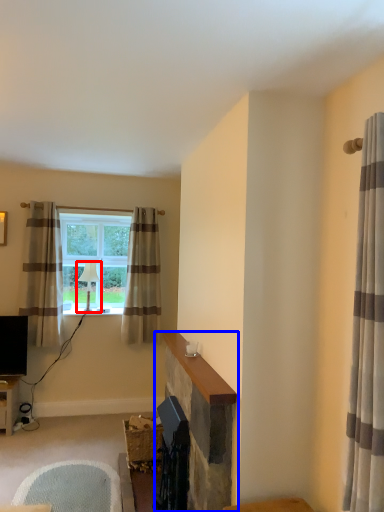
Question: Which object appears closest to the camera in this image, lamp (highlighted by a red box) or fireplace (highlighted by a blue box)?

Choices:
 (A) lamp
 (B) fireplace

Answer: (B)